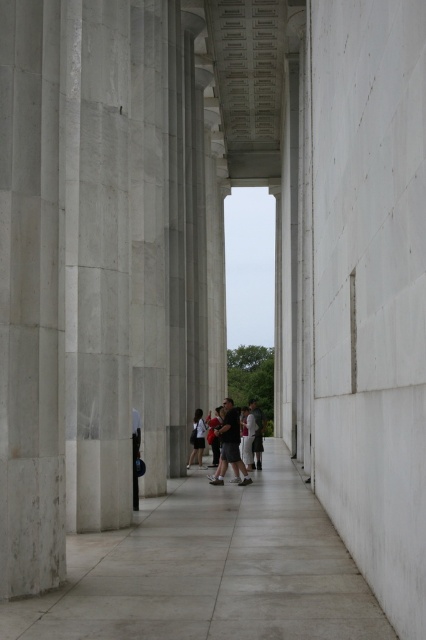
Which is behind, point (216, 429) or point (192, 436)?

Point (216, 429)

Looking at this image, does dark gray fabric pants at center appear over dark gray fabric jacket at center?

Correct, dark gray fabric pants at center is located above dark gray fabric jacket at center.

Find the location of a particular element. dark gray fabric pants at center is located at coordinates pyautogui.click(x=229, y=444).

Is gray concrete pavement at center shorter than dark gray fabric jacket at center?

Yes.

Does gray concrete pavement at center appear on the right side of dark gray fabric jacket at center?

Correct, you'll find gray concrete pavement at center to the right of dark gray fabric jacket at center.

Locate an element on the screen. gray concrete pavement at center is located at coordinates (210, 570).

Does gray concrete pavement at center appear over dark gray fabric pants at center?

No.

Is point (244, 620) closer to viewer compared to point (224, 438)?

Yes, it is in front of point (224, 438).

This screenshot has width=426, height=640. I want to click on gray concrete pavement at center, so click(210, 570).